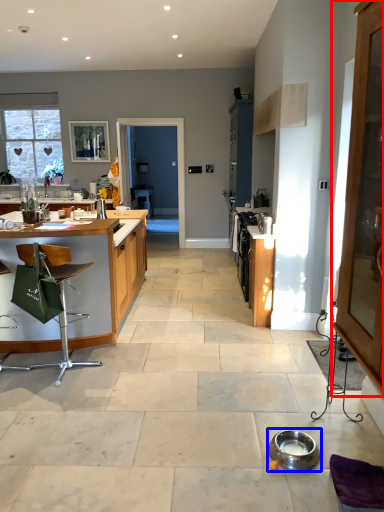
Question: Which object appears closest to the camera in this image, cabinetry (highlighted by a red box) or appliance (highlighted by a blue box)?

Choices:
 (A) cabinetry
 (B) appliance

Answer: (A)